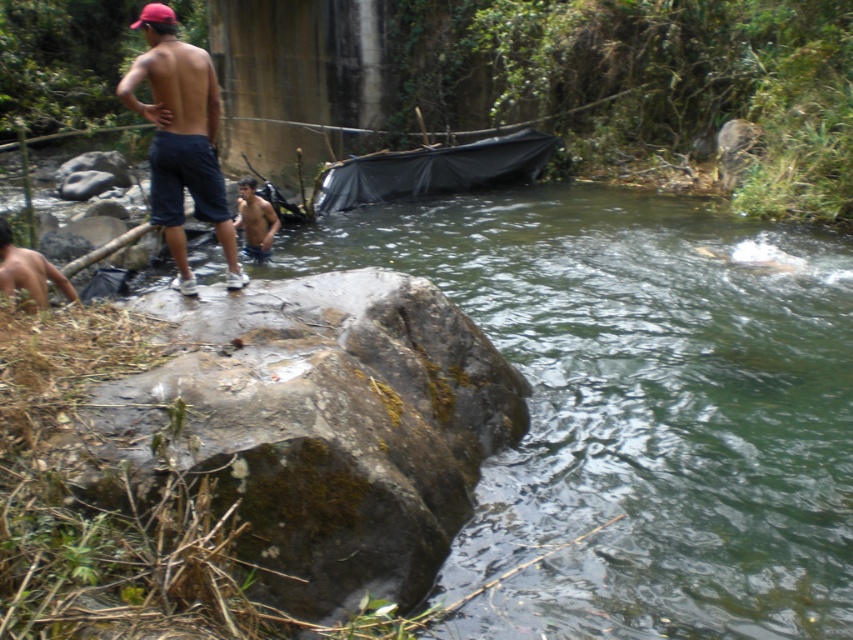
Is green mossy rock at center below mossy stone boulder at lower left?

Incorrect, green mossy rock at center is not positioned below mossy stone boulder at lower left.

Can you confirm if green mossy rock at center is bigger than mossy stone boulder at lower left?

Indeed, green mossy rock at center has a larger size compared to mossy stone boulder at lower left.

Between point (531, 480) and point (142, 396), which one is positioned in front?

Positioned in front is point (142, 396).

Find the location of `green mossy rock at center`. green mossy rock at center is located at coordinates (643, 410).

Does dark blue denim shorts at upper left have a smaller size compared to brown skin boy at lower left?

Actually, dark blue denim shorts at upper left might be larger than brown skin boy at lower left.

Who is taller, dark blue denim shorts at upper left or brown skin boy at lower left?

dark blue denim shorts at upper left

Image resolution: width=853 pixels, height=640 pixels. In order to click on dark blue denim shorts at upper left in this screenshot , I will do `click(181, 138)`.

You are a GUI agent. You are given a task and a screenshot of the screen. Output one action in this format:
    pyautogui.click(x=<x>, y=<y>)
    Task: Click on the dark blue denim shorts at upper left
    The image size is (853, 640).
    Given the screenshot: What is the action you would take?
    pyautogui.click(x=181, y=138)

Is green mossy rock at center below brown skin boy at lower left?

Yes.

Does point (662, 346) come in front of point (36, 259)?

No, it is not.

Locate an element on the screen. The image size is (853, 640). green mossy rock at center is located at coordinates (643, 410).